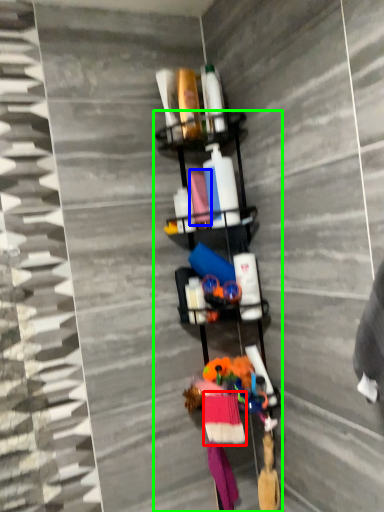
Question: Which object is positioned closest to clothing (highlighted by a red box)? Select from fabric (highlighted by a blue box) and shelf (highlighted by a green box).

Choices:
 (A) fabric
 (B) shelf

Answer: (B)